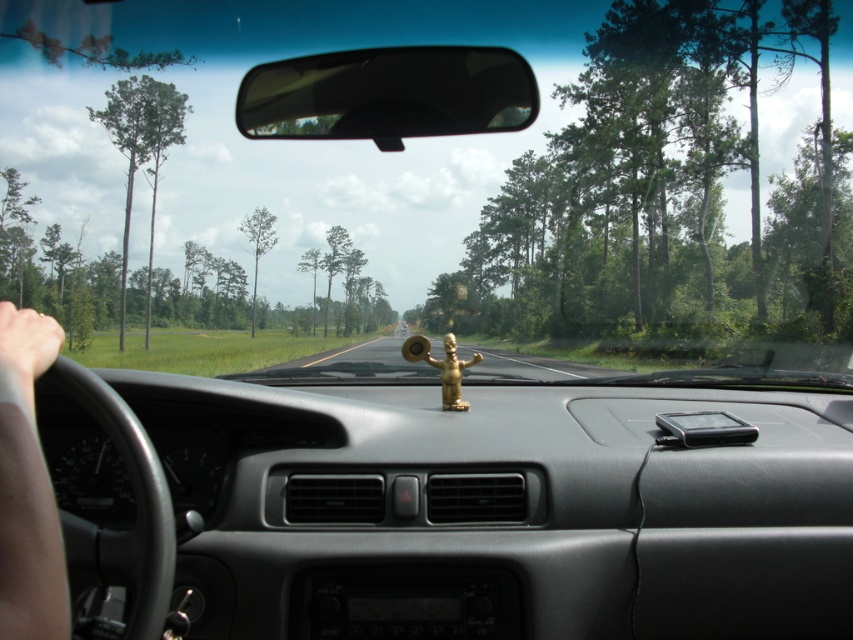
Question: Can you confirm if skinny tan arm at lower left is thinner than skinny flesh-toned hand at left?

Choices:
 (A) no
 (B) yes

Answer: (A)

Question: Which point is closer to the camera?

Choices:
 (A) (51, 339)
 (B) (155, 621)
 (C) (67, 595)

Answer: (C)

Question: Among these points, which one is nearest to the camera?

Choices:
 (A) click(157, 477)
 (B) click(44, 525)
 (C) click(28, 378)

Answer: (B)

Question: Is skinny tan arm at lower left below black leather steering wheel at left?

Choices:
 (A) yes
 (B) no

Answer: (B)

Question: Estimate the real-world distances between objects in this image. Which object is farther from the skinny flesh-toned hand at left?

Choices:
 (A) skinny tan arm at lower left
 (B) black leather steering wheel at left

Answer: (B)

Question: Can you confirm if skinny tan arm at lower left is positioned below skinny flesh-toned hand at left?

Choices:
 (A) no
 (B) yes

Answer: (B)